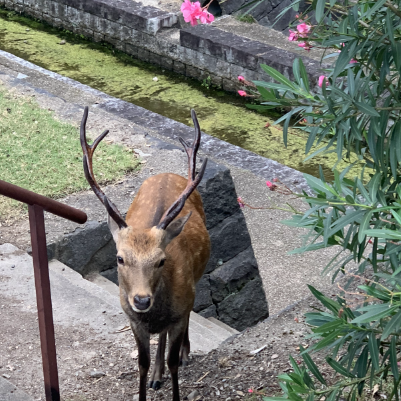
This screenshot has width=401, height=401. Identify the location of handrail. (33, 198).